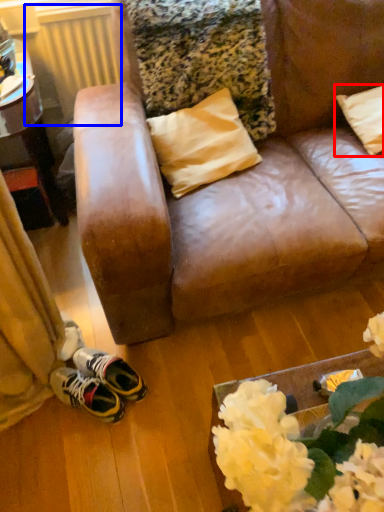
Question: Which point is further to the camera, pillow (highlighted by a red box) or radiator (highlighted by a blue box)?

Choices:
 (A) pillow
 (B) radiator

Answer: (B)